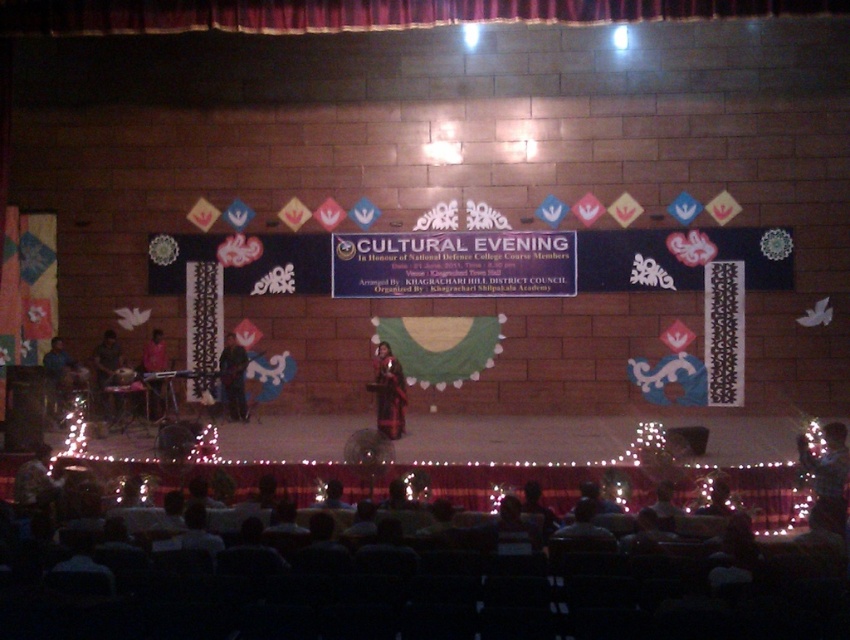
You are a photographer at the cultural evening event and want to capture a photo that includes both the dark red fabric dress at center and the matte black keyboard at center. Since the keyboard is taller, how can you position your camera to ensure both objects are in focus?

Since the dark red fabric dress at center is shorter than the matte black keyboard at center, you can lower your camera angle to capture both objects in focus by positioning the lens closer to the dress while still framing the taller keyboard within the shot.

What is the color of the object located at point [364,13]?

The point [364,13] corresponds to the velvet red curtain at upper center, so the color is red.

You are an event coordinator preparing to adjust the lighting for the stage. You need to ensure that the velvet red curtain at upper center and the silky black dress at center are both illuminated properly. Given their sizes, which object requires a wider light beam to cover its entire surface?

The velvet red curtain at upper center requires a wider light beam because its width is larger than the silky black dress at center.